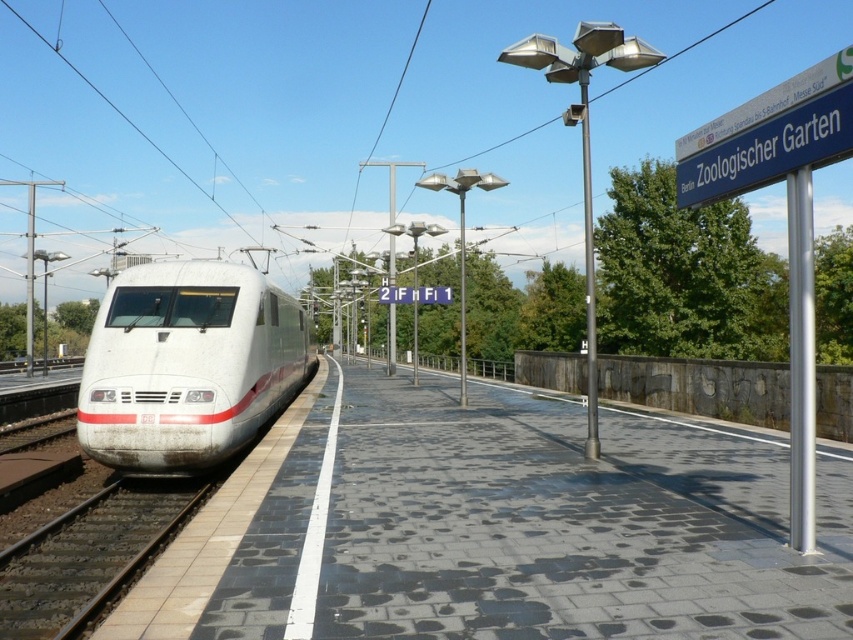
Question: Is black textured platform at center closer to camera compared to white glossy bullet train at left?

Choices:
 (A) yes
 (B) no

Answer: (A)

Question: Does white glossy bullet train at left appear on the right side of black asphalt train track at lower left?

Choices:
 (A) no
 (B) yes

Answer: (A)

Question: Which of the following is the closest to the observer?

Choices:
 (A) black asphalt train track at lower left
 (B) black textured platform at center

Answer: (B)

Question: Which of the following is the farthest from the observer?

Choices:
 (A) black asphalt train track at lower left
 (B) white glossy bullet train at left
 (C) black textured platform at center

Answer: (B)

Question: Is white glossy bullet train at left wider than black asphalt train track at lower left?

Choices:
 (A) yes
 (B) no

Answer: (A)

Question: Which of the following is the farthest from the observer?

Choices:
 (A) white glossy bullet train at left
 (B) black textured platform at center
 (C) black asphalt train track at lower left

Answer: (A)